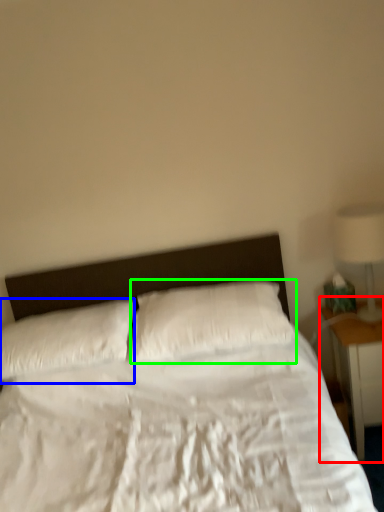
Question: Based on their relative distances, which object is farther from nightstand (highlighted by a red box)? Choose from pillow (highlighted by a blue box) and pillow (highlighted by a green box).

Choices:
 (A) pillow
 (B) pillow

Answer: (A)